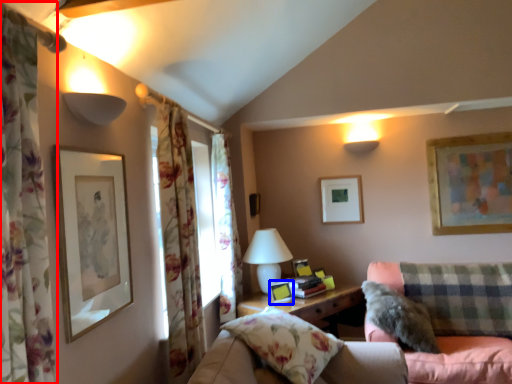
Question: Which object is closer to the camera taking this photo, curtain (highlighted by a red box) or picture frame (highlighted by a blue box)?

Choices:
 (A) curtain
 (B) picture frame

Answer: (A)